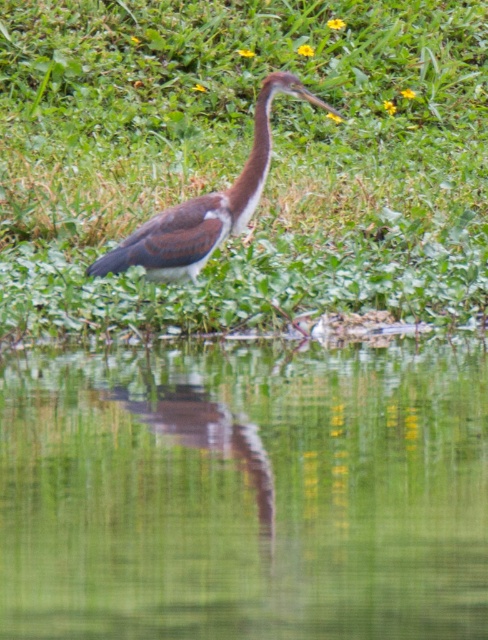
You are a photographer aiming to capture the reflection of the bird in the water. To ensure the reflection is clear, you need to position yourself such that the green leafy grass at center is not blocking your view. Based on the coordinates provided, where should you position yourself relative to the grass?

The green leafy grass at center is located at point (x=243, y=160). To avoid blocking the reflection, position yourself on the opposite side of the grass from the bird, ensuring the grass does not obstruct the view of the water surface where the reflection is formed.

You are a photographer aiming to capture the reflection of the bird in the water. You notice the green leafy grass at center and the green reflective water at center. Which object should you focus on to ensure the bird reflection is visible?

The green reflective water at center is the surface where the reflection occurs, so focusing on it will allow you to capture the bird reflection. The green leafy grass at center is positioned over it and may obstruct the view.